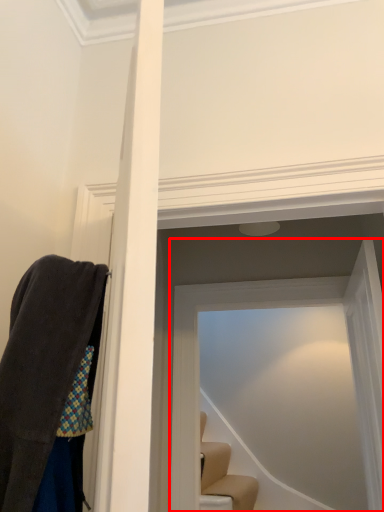
Question: From the image's perspective, considering the relative positions of glass door (annotated by the red box) and glass door in the image provided, where is glass door (annotated by the red box) located with respect to the staircase?

Choices:
 (A) below
 (B) above

Answer: (A)